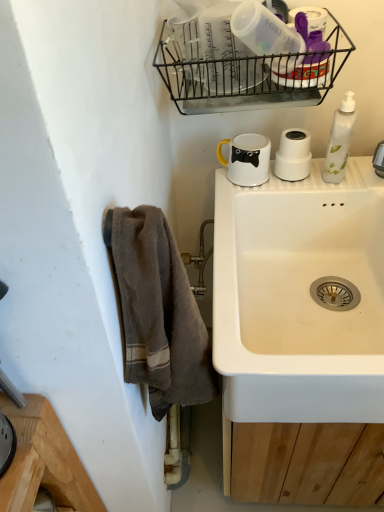
Describe the element at coordinates (299, 298) in the screenshot. Image resolution: width=384 pixels, height=512 pixels. I see `white ceramic sink at center` at that location.

I want to click on white glossy bottle at right, so click(x=340, y=140).

What do you see at coordinates (227, 55) in the screenshot? The image size is (384, 512). I see `transparent plastic container at upper center, which appears as the 1th appliance when viewed from the left` at bounding box center [227, 55].

Find the location of a particular element. brown textured towel at left is located at coordinates (158, 312).

The width and height of the screenshot is (384, 512). In order to click on white ceramic sink at center in this screenshot , I will do `click(299, 298)`.

How distant is brown textured towel at left from transparent plastic container at upper center, acting as the 1th appliance starting from the front?

A distance of 52.79 centimeters exists between brown textured towel at left and transparent plastic container at upper center, acting as the 1th appliance starting from the front.

From the image's perspective, would you say brown textured towel at left is shown under transparent plastic container at upper center, which is the second appliance in right-to-left order?

Yes, from the image's perspective, brown textured towel at left is beneath transparent plastic container at upper center, which is the second appliance in right-to-left order.

From their relative heights in the image, would you say brown textured towel at left is taller or shorter than transparent plastic container at upper center, which appears as the second appliance when viewed from the back?

Clearly, brown textured towel at left is taller compared to transparent plastic container at upper center, which appears as the second appliance when viewed from the back.

There is a brown textured towel at left. At what (x,y) coordinates should I click in order to perform the action: click on the 2nd appliance above it (from a real-world perspective). Please return your answer as a coordinate pair (x, y). Looking at the image, I should click on (227, 55).

Which is nearer, (236,73) or (278,174)?

Clearly, point (236,73) is closer to the camera than point (278,174).

Are transparent plastic container at upper center, acting as the 1th appliance starting from the front, and white matte cup at upper right, which is counted as the 2th appliance, starting from the left, beside each other?

There is a gap between transparent plastic container at upper center, acting as the 1th appliance starting from the front, and white matte cup at upper right, which is counted as the 2th appliance, starting from the left.

Between transparent plastic container at upper center, which appears as the second appliance when viewed from the back, and white matte cup at upper right, the 1th appliance when ordered from right to left, which one appears on the right side from the viewer's perspective?

Positioned to the right is white matte cup at upper right, the 1th appliance when ordered from right to left.

You are a GUI agent. You are given a task and a screenshot of the screen. Output one action in this format:
    pyautogui.click(x=<x>, y=<y>)
    Task: Click on the appliance below the transparent plastic container at upper center, which appears as the second appliance when viewed from the back (from the image's perspective)
    The height and width of the screenshot is (512, 384).
    Given the screenshot: What is the action you would take?
    pyautogui.click(x=293, y=155)

Between point (313, 389) and point (300, 54), which one is positioned in front?

The point (313, 389) is in front.

Are white ceramic sink at center and black wire basket at upper center beside each other?

white ceramic sink at center and black wire basket at upper center are clearly separated.

Considering the relative positions of white ceramic sink at center and black wire basket at upper center in the image provided, is white ceramic sink at center to the left of black wire basket at upper center from the viewer's perspective?

No.

Between white ceramic sink at center and black wire basket at upper center, which one has smaller width?

black wire basket at upper center is thinner.

From the image's perspective, which is below, black wire basket at upper center or brown textured towel at left?

brown textured towel at left, from the image's perspective.

Considering the relative positions of black wire basket at upper center and brown textured towel at left in the image provided, is black wire basket at upper center to the left of brown textured towel at left from the viewer's perspective?

No.

From a real-world perspective, relative to brown textured towel at left, is black wire basket at upper center vertically above or below?

black wire basket at upper center is above brown textured towel at left.

Is black wire basket at upper center facing towards brown textured towel at left?

No, black wire basket at upper center is not facing towards brown textured towel at left.

Identify the location of sink that appears in front of the white glossy mug at upper right. (299, 298).

From the image's perspective, which one is positioned higher, white glossy mug at upper right or white ceramic sink at center?

white glossy mug at upper right, from the image's perspective.

Can you confirm if white glossy mug at upper right is wider than white ceramic sink at center?

In fact, white glossy mug at upper right might be narrower than white ceramic sink at center.

Considering the sizes of objects white glossy mug at upper right and white ceramic sink at center in the image provided, who is smaller, white glossy mug at upper right or white ceramic sink at center?

Smaller between the two is white glossy mug at upper right.

From the image's perspective, would you say white matte cup at upper right, the 2th appliance from the front, is shown under brown textured towel at left?

No, from the image's perspective, white matte cup at upper right, the 2th appliance from the front, is not below brown textured towel at left.

Relative to brown textured towel at left, is white matte cup at upper right, which is counted as the 2th appliance, starting from the left, in front or behind?

white matte cup at upper right, which is counted as the 2th appliance, starting from the left, is positioned farther from the viewer than brown textured towel at left.

How different are the orientations of white matte cup at upper right, which appears as the 1th appliance when viewed from the back, and brown textured towel at left in degrees?

The angular difference between white matte cup at upper right, which appears as the 1th appliance when viewed from the back, and brown textured towel at left is 88.1 degrees.

Could you tell me if white matte cup at upper right, the 2th appliance from the front, is turned towards brown textured towel at left?

No, white matte cup at upper right, the 2th appliance from the front, is not aimed at brown textured towel at left.

I want to click on basket that is on the left side of white glossy mug at upper right, so click(x=245, y=66).

From the image's perspective, which one is positioned lower, black wire basket at upper center or white glossy mug at upper right?

white glossy mug at upper right, from the image's perspective.

Is black wire basket at upper center to the left of white glossy mug at upper right from the viewer's perspective?

Indeed, black wire basket at upper center is positioned on the left side of white glossy mug at upper right.

Which of these two, black wire basket at upper center or white glossy mug at upper right, is thinner?

white glossy mug at upper right.

Where is `the 1st appliance behind the brown textured towel at left`? Image resolution: width=384 pixels, height=512 pixels. the 1st appliance behind the brown textured towel at left is located at coordinates (227, 55).

Where is `appliance that is in front of the white matte cup at upper right, the first appliance in the bottom-to-top sequence`? appliance that is in front of the white matte cup at upper right, the first appliance in the bottom-to-top sequence is located at coordinates (227, 55).

Consider the image. Looking at the image, which one is located closer to brown textured towel at left, transparent plastic container at upper center, placed as the second appliance when sorted from bottom to top, or white ceramic sink at center?

Based on the image, white ceramic sink at center appears to be nearer to brown textured towel at left.

Based on their spatial positions, is white matte cup at upper right, the 2th appliance from the front, or brown textured towel at left further from transparent plastic container at upper center, which appears as the 1th appliance when viewed from the left?

brown textured towel at left is positioned further to the anchor transparent plastic container at upper center, which appears as the 1th appliance when viewed from the left.

Which object lies further to the anchor point white matte cup at upper right, the 1th appliance when ordered from right to left, transparent plastic container at upper center, which appears as the second appliance when viewed from the back, or white ceramic sink at center?

Among the two, white ceramic sink at center is located further to white matte cup at upper right, the 1th appliance when ordered from right to left.

Considering their positions, is white glossy bottle at right positioned closer to transparent plastic container at upper center, which appears as the second appliance when viewed from the back, than brown textured towel at left?

white glossy bottle at right is closer to transparent plastic container at upper center, which appears as the second appliance when viewed from the back.

Estimate the real-world distances between objects in this image. Which object is closer to white matte cup at upper right, the 1th appliance when ordered from right to left, brown textured towel at left or white glossy mug at upper right?

The object closer to white matte cup at upper right, the 1th appliance when ordered from right to left, is white glossy mug at upper right.

Based on their spatial positions, is black wire basket at upper center or white matte cup at upper right, which is counted as the 2th appliance, starting from the left, further from brown textured towel at left?

white matte cup at upper right, which is counted as the 2th appliance, starting from the left, lies further to brown textured towel at left than the other object.

From the image, which object appears to be nearer to white matte cup at upper right, the 1th appliance when ordered from right to left, white ceramic sink at center or brown textured towel at left?

Based on the image, white ceramic sink at center appears to be nearer to white matte cup at upper right, the 1th appliance when ordered from right to left.

Based on their spatial positions, is brown textured towel at left or white matte cup at upper right, the 2th appliance from the front, further from white glossy bottle at right?

brown textured towel at left is positioned further to the anchor white glossy bottle at right.

Image resolution: width=384 pixels, height=512 pixels. In order to click on coffee cup located between brown textured towel at left and white matte cup at upper right, the 2th appliance from the front, in the depth direction in this screenshot , I will do `click(247, 159)`.

In order to click on cleaning product between black wire basket at upper center and white ceramic sink at center in the up-down direction in this screenshot , I will do `click(340, 140)`.

Locate an element on the screen. This screenshot has width=384, height=512. coffee cup between white ceramic sink at center and white matte cup at upper right, the first appliance in the bottom-to-top sequence, from front to back is located at coordinates (247, 159).

At what (x,y) coordinates should I click in order to perform the action: click on coffee cup between transparent plastic container at upper center, which appears as the second appliance when viewed from the back, and brown textured towel at left vertically. Please return your answer as a coordinate pair (x, y). Image resolution: width=384 pixels, height=512 pixels. Looking at the image, I should click on (247, 159).